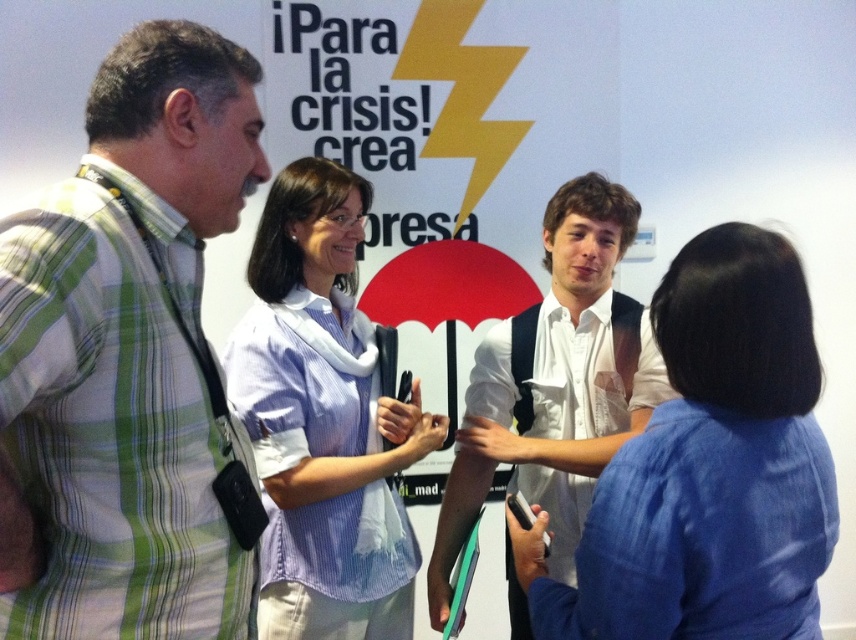
Question: Can you confirm if green plaid shirt at left is wider than white shirt at center?

Choices:
 (A) yes
 (B) no

Answer: (B)

Question: In this image, where is green plaid shirt at left located relative to blue cotton shirt at center?

Choices:
 (A) above
 (B) below

Answer: (A)

Question: Does blue cotton shirt at center lie in front of white shirt at center?

Choices:
 (A) yes
 (B) no

Answer: (A)

Question: Which of the following is the closest to the observer?

Choices:
 (A) green plaid shirt at left
 (B) white shirt at center
 (C) blue cotton shirt at center
 (D) light blue striped shirt at center

Answer: (A)

Question: Which is nearer to the blue cotton shirt at center?

Choices:
 (A) green plaid shirt at left
 (B) white shirt at center
 (C) light blue striped shirt at center

Answer: (B)

Question: Which of the following is the farthest from the observer?

Choices:
 (A) (654, 637)
 (B) (524, 362)

Answer: (B)